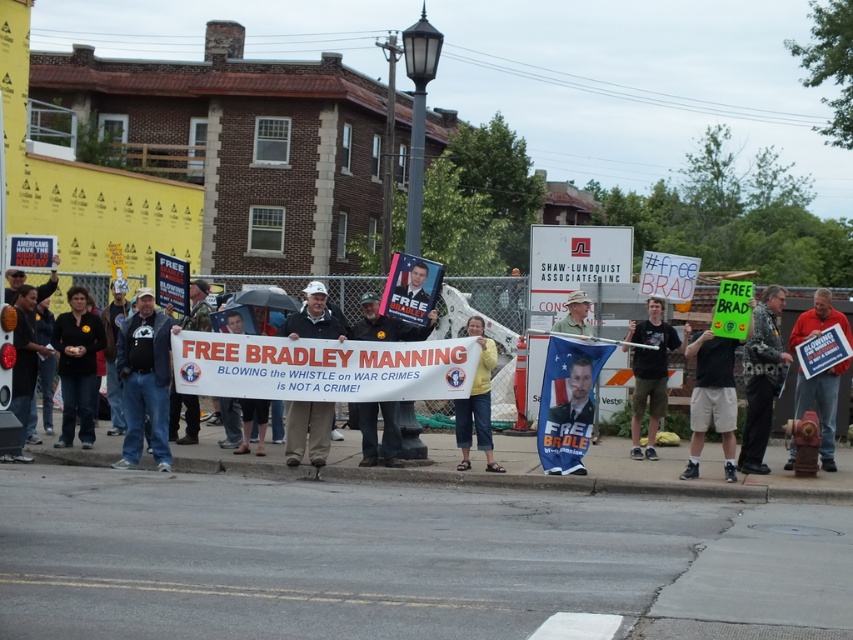
Question: Which point is farther to the camera?

Choices:
 (A) (798, 339)
 (B) (384, 417)
 (C) (776, 339)
 (D) (479, 438)

Answer: (B)

Question: Can you confirm if camouflage jacket at center is bigger than black cotton shirt at center?

Choices:
 (A) no
 (B) yes

Answer: (A)

Question: Based on their relative distances, which object is nearer to the black matte sign at center?

Choices:
 (A) dark blue jeans at center
 (B) camouflage jacket at center
 (C) matte black sign at center

Answer: (B)

Question: Is camouflage jacket at center positioned before camouflage fabric sign at center?

Choices:
 (A) yes
 (B) no

Answer: (A)

Question: Which point is farther from the camera taking this photo?

Choices:
 (A) (495, 356)
 (B) (718, 413)
 (C) (799, 396)
 (D) (83, 403)

Answer: (D)

Question: Is camouflage jacket at center further to the viewer compared to black cotton shirt at center?

Choices:
 (A) yes
 (B) no

Answer: (B)